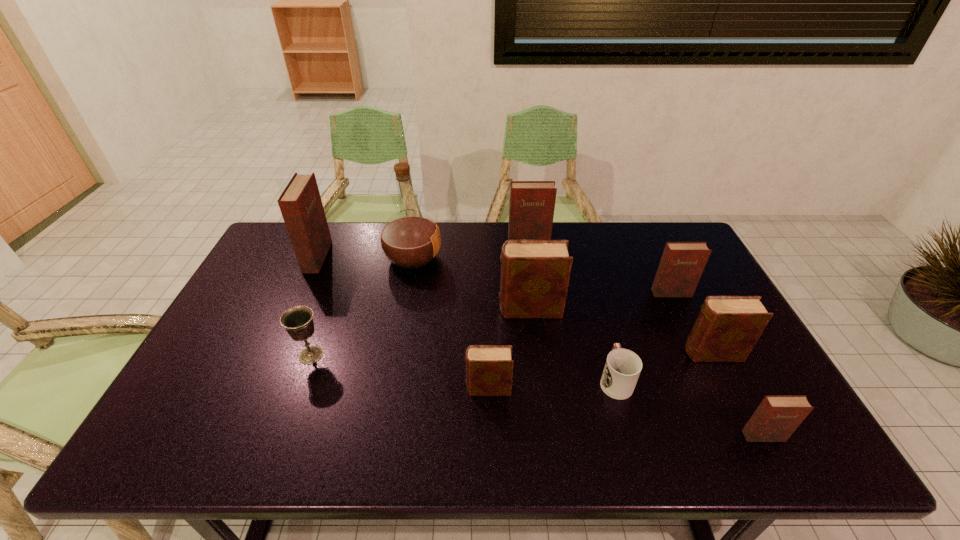
The width and height of the screenshot is (960, 540). In order to click on free space between the fifth nearest diary and the shortest object in this screenshot , I will do [643, 336].

Identify the location of vacant region between the second biggest reddish-brown diary and the red cup. Image resolution: width=960 pixels, height=540 pixels. (572, 310).

Locate an element on the screen. This screenshot has height=540, width=960. vacant area that lies between the pink liquor and the second reddish-brown diary from left to right is located at coordinates (470, 249).

The height and width of the screenshot is (540, 960). I want to click on free spot between the second reddish-brown diary from left to right and the red cup, so click(572, 310).

Select which object appears as the second closest to the fourth object from right to left. Please provide its 2D coordinates. Your answer should be formatted as a tuple, i.e. [(x, y)], where the tuple contains the x and y coordinates of a point satisfying the conditions above.

[(535, 274)]

Locate an element on the screen. This screenshot has height=540, width=960. object that stands as the fifth closest to the nearest reddish-brown diary is located at coordinates (489, 368).

The height and width of the screenshot is (540, 960). Find the location of `the fourth closest diary to the third reddish-brown diary from right to left`. the fourth closest diary to the third reddish-brown diary from right to left is located at coordinates (489, 368).

This screenshot has height=540, width=960. In order to click on diary that is the nearest to the third nearest diary in this screenshot , I will do `click(682, 263)`.

What are the coordinates of `the closest reddish-brown diary to the second nearest diary` in the screenshot? It's located at (776, 418).

Select which reddish-brown diary appears as the fourth closest to the pink liquor. Please provide its 2D coordinates. Your answer should be formatted as a tuple, i.e. [(x, y)], where the tuple contains the x and y coordinates of a point satisfying the conditions above.

[(776, 418)]